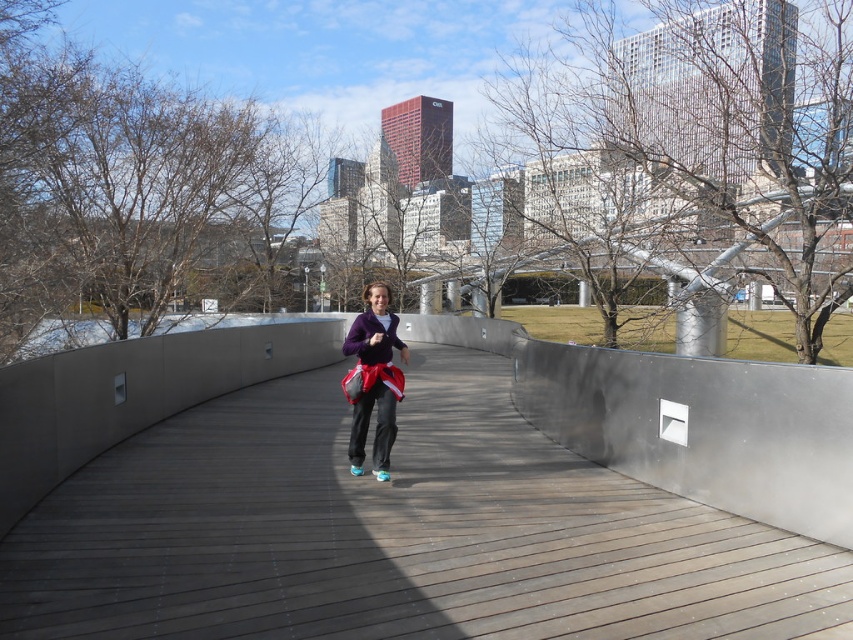
You are a fashion designer observing a person in an urban park. They are wearing a matte purple jacket at center and a purple fleece sweatshirt at center. Which piece of clothing is bigger in size?

The matte purple jacket at center is larger in size compared to the purple fleece sweatshirt at center.

Based on the photo, you are a fashion designer observing the person in the urban park. You notice the person is wearing both a matte purple jacket at center and a purple fleece sweatshirt at center. Which clothing item is longer in height?

The matte purple jacket at center is taller than the purple fleece sweatshirt at center, so the jacket is longer in height.

You are standing on the curved wooden walkway and want to take a photo of the city skyline in the background. The wooden at center and matte purple jacket at center are in your camera frame. Which object should you adjust your focus to ensure the city skyline is clear?

The wooden at center is shorter than the matte purple jacket at center, so adjusting focus to the matte purple jacket at center will help ensure the city skyline in the background is clear.